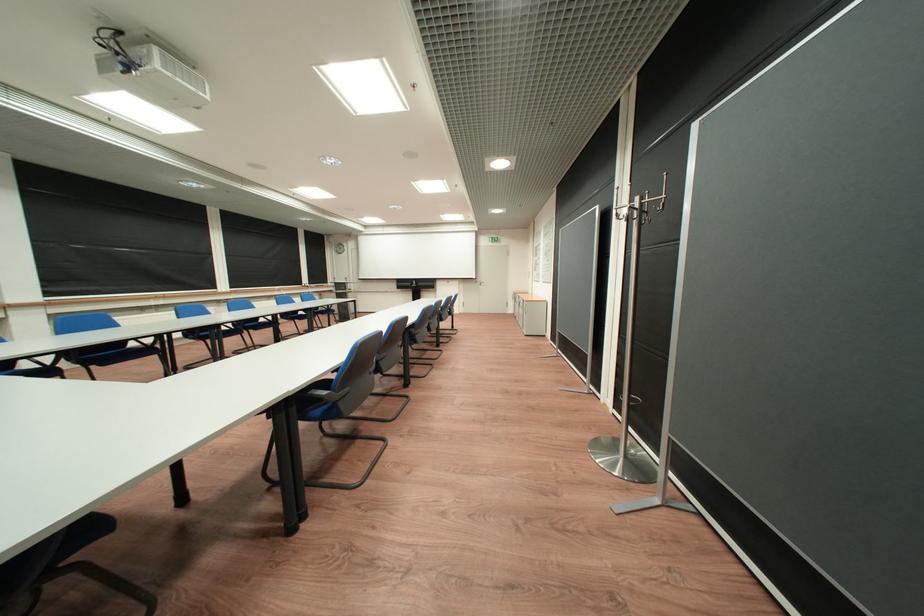
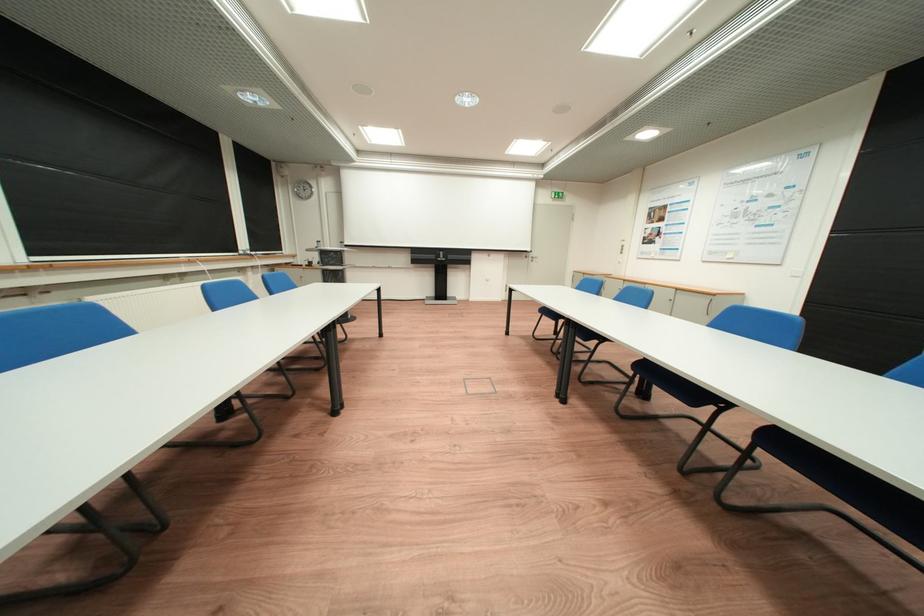
Question: I am providing you with two images of the same scene from different viewpoints. Which of the following objects are not visible in image2?

Choices:
 (A) projector screen handle
 (B) blue chair sitting surface
 (C) microwave dial
 (D) cabinet handle

Answer: (B)